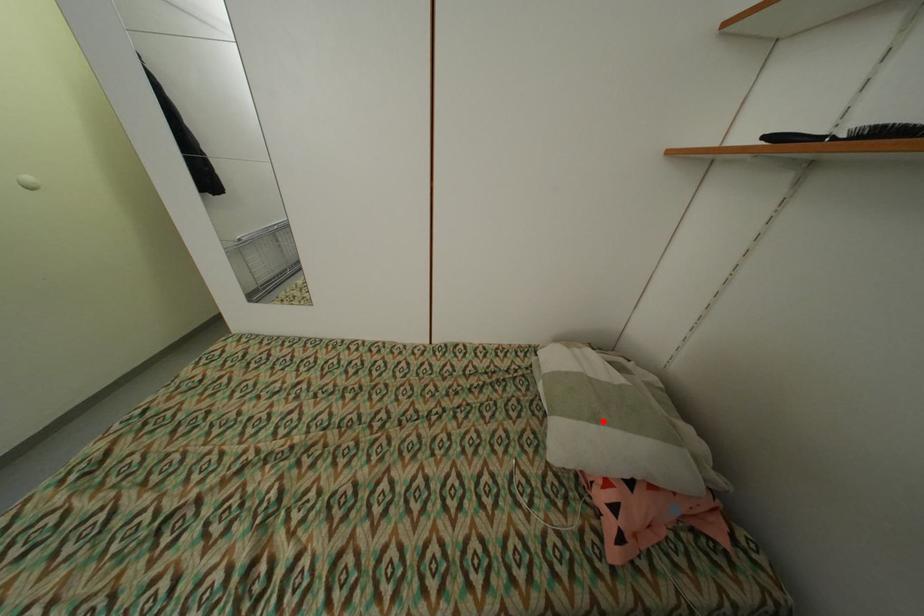
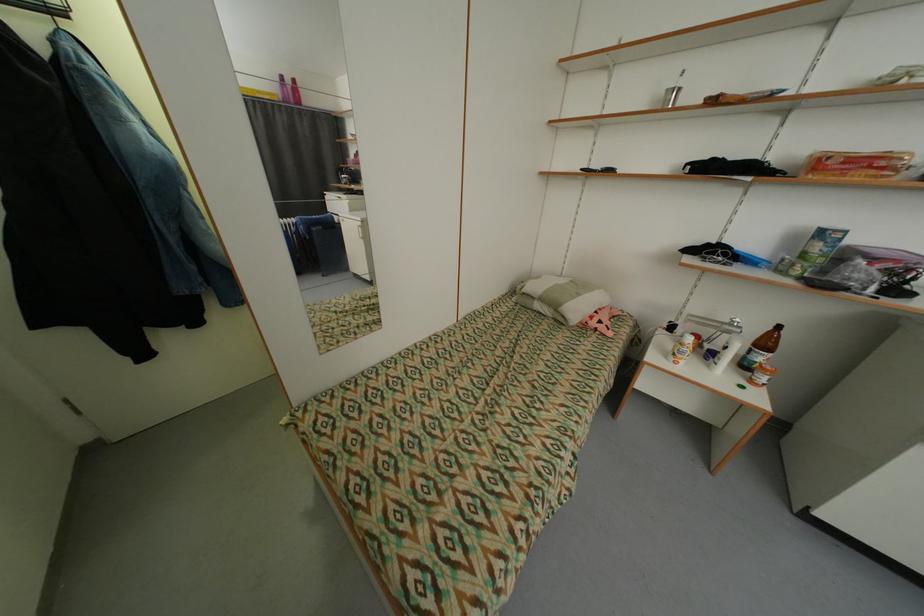
Question: I am providing you with two images of the same scene from different viewpoints. Given a red point in image1, look at the same physical point in image2. Is it:

Choices:
 (A) Closer to the viewpoint
 (B) Farther from the viewpoint

Answer: (A)